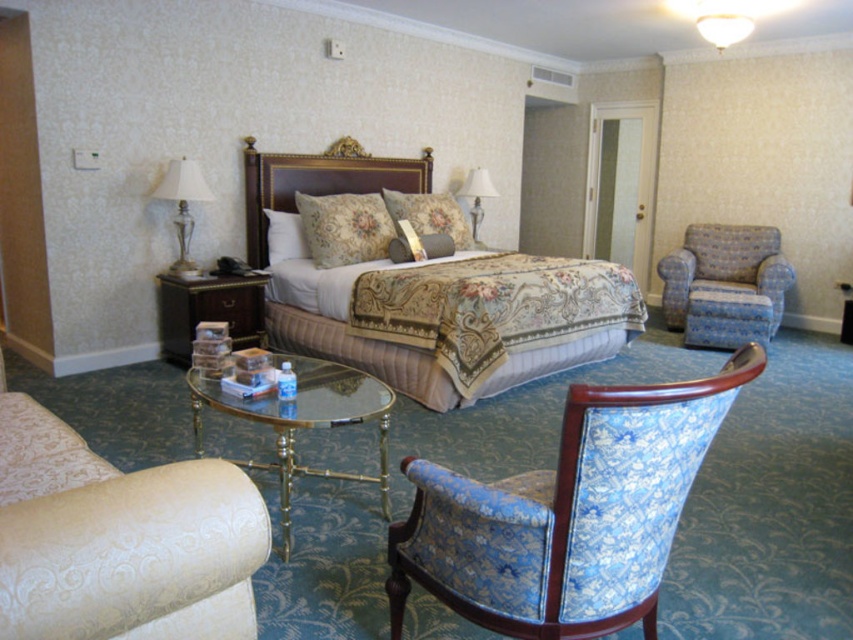
You are a guest in the hotel room and want to sit in the blue floral fabric swivel chair at lower right. Can you sit there without moving the clear glass table at center?

The blue floral fabric swivel chair at lower right is positioned under the clear glass table at center, so you can sit in the blue floral fabric swivel chair at lower right without moving the clear glass table at center because it is already under the table.

You are a hotel guest who wants to place a rectangular luggage box on the floor between the clear glass table at center and the brown wood side table at left. The luggage box is 1.2 meters wide. Can you determine if there is enough space between the two tables to place the luggage box horizontally?

The clear glass table at center might be wider than brown wood side table at left, so the space between them may not be sufficient to accommodate the 1.2 meters wide luggage box. It is recommended to measure the exact distance before placing the luggage box.